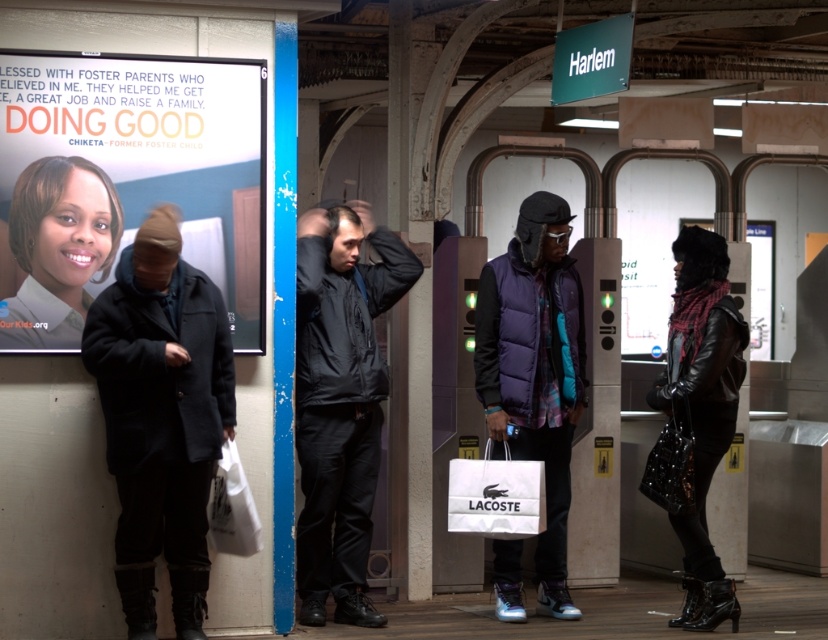
Question: In this image, where is leather jacket at right located relative to matte black jacket at left?

Choices:
 (A) right
 (B) left

Answer: (A)

Question: Can you confirm if white fabric shopping bag at center is positioned to the left of white paper bag at lower left?

Choices:
 (A) yes
 (B) no

Answer: (B)

Question: Does purple down jacket at center have a larger size compared to leather jacket at right?

Choices:
 (A) yes
 (B) no

Answer: (A)

Question: Which object is positioned closest to the black matte jacket at center?

Choices:
 (A) black wool coat at left
 (B) leather jacket at right
 (C) matte black poster at upper left

Answer: (C)

Question: Which object is the farthest from the leather jacket at right?

Choices:
 (A) black matte jacket at center
 (B) matte black poster at upper left

Answer: (B)

Question: Among these points, which one is nearest to the camera?

Choices:
 (A) (740, 342)
 (B) (108, 56)

Answer: (B)